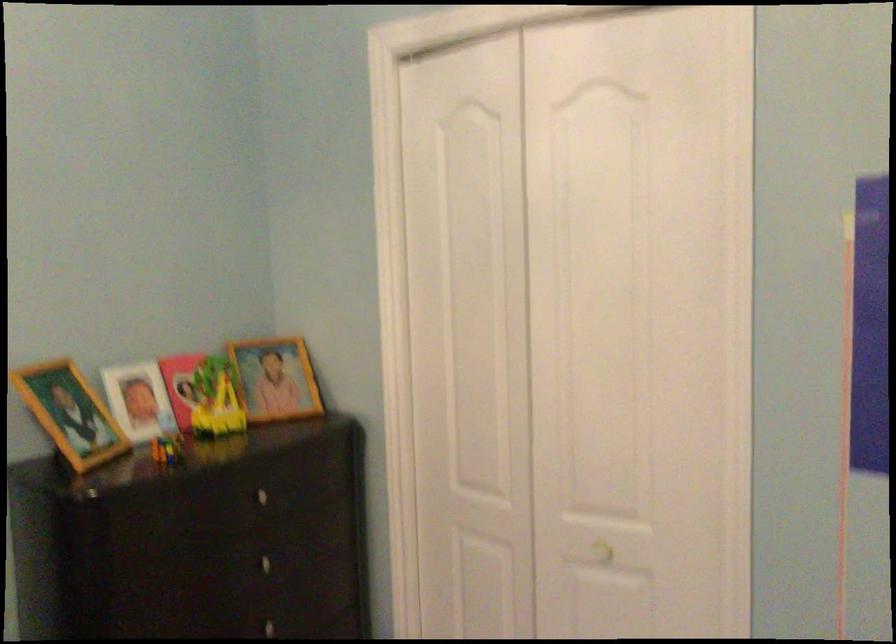
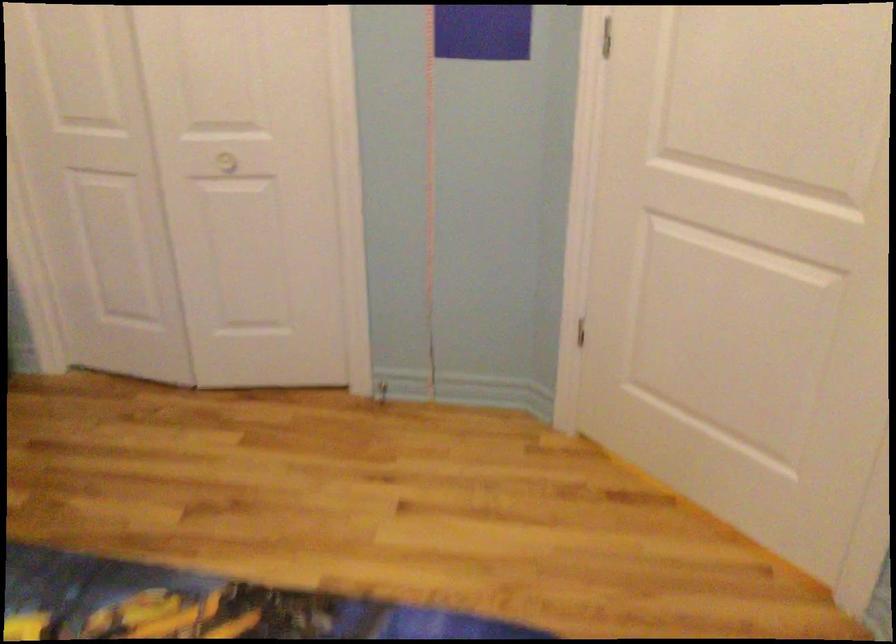
The first image is from the beginning of the video and the second image is from the end. How did the camera likely rotate when shooting the video?

The rotation direction of the camera is right-down.